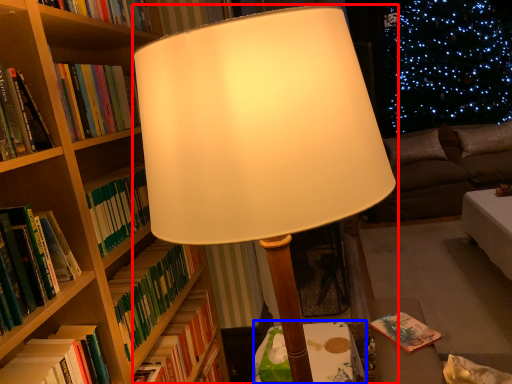
Question: Which point is closer to the camera, lamp (highlighted by a red box) or table (highlighted by a blue box)?

Choices:
 (A) lamp
 (B) table

Answer: (A)